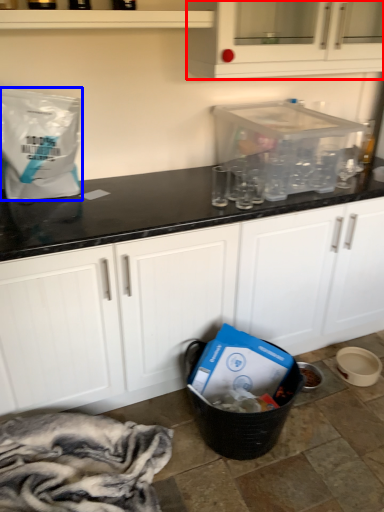
Question: Which of the following is the farthest to the observer, cabinetry (highlighted by a red box) or paper bag (highlighted by a blue box)?

Choices:
 (A) cabinetry
 (B) paper bag

Answer: (A)